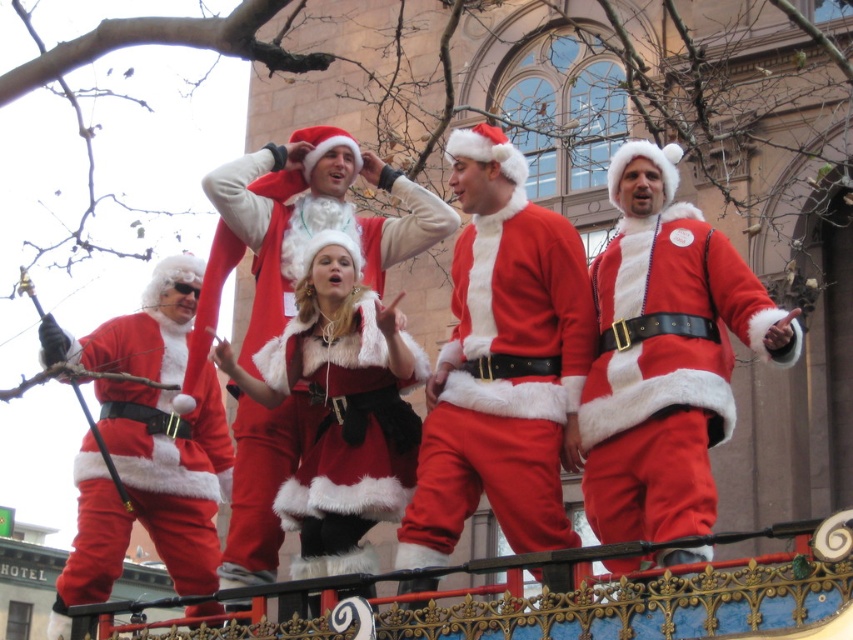
Is matte red santa suit at center above fuzzy red santa at center?

Correct, matte red santa suit at center is located above fuzzy red santa at center.

Is point (465, 371) in front of point (677, 352)?

No.

At what (x,y) coordinates should I click in order to perform the action: click on matte red santa suit at center. Please return your answer as a coordinate pair (x, y). The width and height of the screenshot is (853, 640). Looking at the image, I should click on (502, 364).

Which of these two, fuzzy red santa suit at center or matte red santa suit at left, stands taller?

Standing taller between the two is fuzzy red santa suit at center.

Between point (218, 202) and point (218, 556), which one is positioned in front?

Positioned in front is point (218, 202).

This screenshot has width=853, height=640. What do you see at coordinates (300, 230) in the screenshot?
I see `fuzzy red santa suit at center` at bounding box center [300, 230].

Identify the location of fuzzy red santa suit at center. (300, 230).

Consider the image. Is fuzzy red santa at center positioned before matte red santa suit at left?

Yes, it is in front of matte red santa suit at left.

Between fuzzy red santa at center and matte red santa suit at left, which one is positioned higher?

fuzzy red santa at center is higher up.

The width and height of the screenshot is (853, 640). What do you see at coordinates (665, 355) in the screenshot? I see `fuzzy red santa at center` at bounding box center [665, 355].

Find the location of `fuzzy red santa at center`. fuzzy red santa at center is located at coordinates (665, 355).